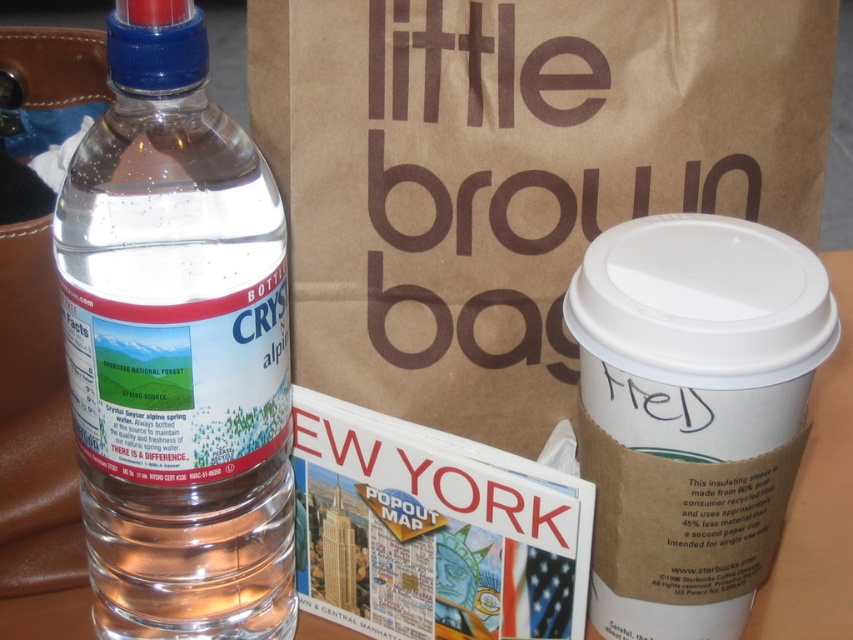
Question: Which of the following is the farthest from the observer?

Choices:
 (A) white paper cup at right
 (B) transparent plastic bottle at left
 (C) brown paper bag at upper center

Answer: (C)

Question: Can you confirm if brown paper bag at upper center is positioned below transparent plastic bottle at left?

Choices:
 (A) no
 (B) yes

Answer: (A)

Question: Is transparent plastic bottle at left to the right of white paper cup at right from the viewer's perspective?

Choices:
 (A) yes
 (B) no

Answer: (B)

Question: Which object is farther from the camera taking this photo?

Choices:
 (A) transparent plastic bottle at left
 (B) brown paper bag at upper center

Answer: (B)

Question: Which point is farther to the camera?

Choices:
 (A) (801, 3)
 (B) (257, 323)

Answer: (A)

Question: Is brown paper bag at upper center below transparent plastic bottle at left?

Choices:
 (A) yes
 (B) no

Answer: (B)